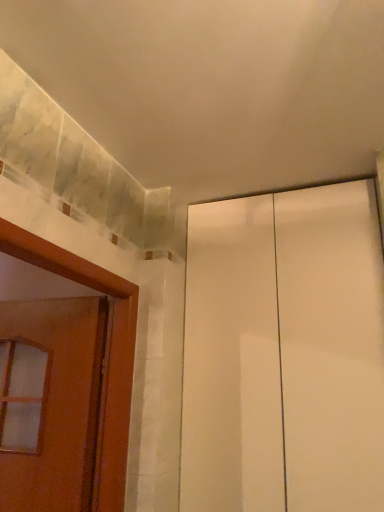
Measure the distance between white glossy cabinet at upper right and camera.

They are 1.24 meters apart.

What do you see at coordinates (284, 353) in the screenshot?
I see `white glossy cabinet at upper right` at bounding box center [284, 353].

Where is `white glossy cabinet at upper right`? The height and width of the screenshot is (512, 384). white glossy cabinet at upper right is located at coordinates (284, 353).

Locate an element on the screen. Image resolution: width=384 pixels, height=512 pixels. white glossy cabinet at upper right is located at coordinates [284, 353].